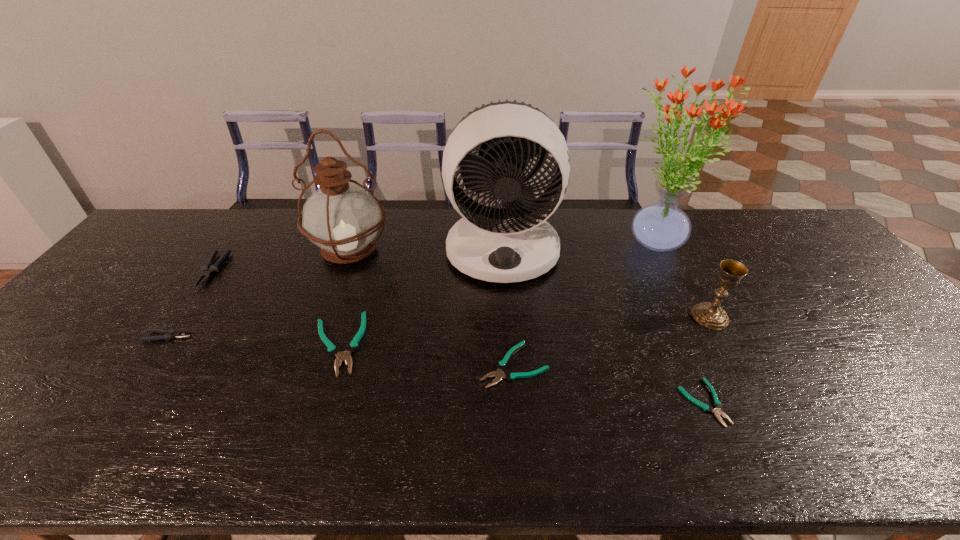
In order to click on free space between the red flower arrangement and the gold chalice in this screenshot , I will do `click(682, 279)`.

Identify the location of free space between the smaller gray pliers and the gold chalice. (439, 327).

Locate an element on the screen. The image size is (960, 540). vacant region between the rightmost pliers and the fan is located at coordinates (603, 326).

Identify the location of free spot between the flower arrangement and the leftmost teal pliers. This screenshot has height=540, width=960. (495, 293).

You are a GUI agent. You are given a task and a screenshot of the screen. Output one action in this format:
    pyautogui.click(x=<x>, y=<y>)
    Task: Click on the free space between the red flower arrangement and the smaller gray pliers
    The image size is (960, 540).
    Given the screenshot: What is the action you would take?
    pyautogui.click(x=412, y=289)

The width and height of the screenshot is (960, 540). Identify the location of vacant area that lies between the flower arrangement and the smallest teal pliers. (679, 322).

This screenshot has height=540, width=960. In order to click on vacant space that's between the rightmost pliers and the smaller gray pliers in this screenshot , I will do `click(436, 369)`.

Find the location of a particular element. The width and height of the screenshot is (960, 540). blank region between the rightmost pliers and the bigger gray pliers is located at coordinates (458, 336).

The height and width of the screenshot is (540, 960). Identify the location of vacant area that lies between the oil lamp and the fan. (426, 250).

Identify which object is the third nearest to the shortest pliers. Please provide its 2D coordinates. Your answer should be formatted as a tuple, i.e. [(x, y)], where the tuple contains the x and y coordinates of a point satisfying the conditions above.

[(511, 241)]